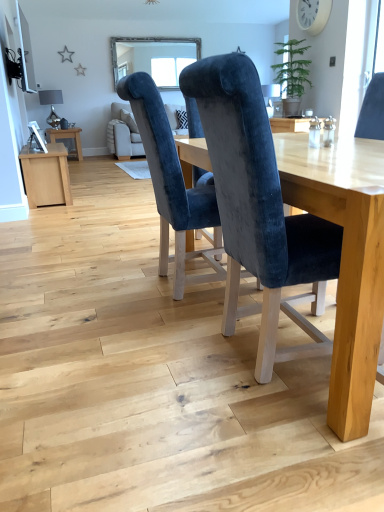
The image size is (384, 512). What are the coordinates of `blank space to the left of velvet blue chair at center, the first chair positioned from the right` in the screenshot? It's located at (150, 360).